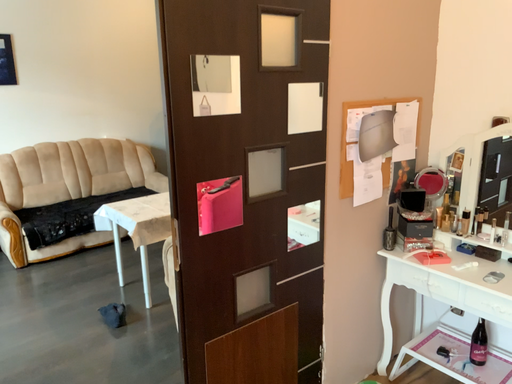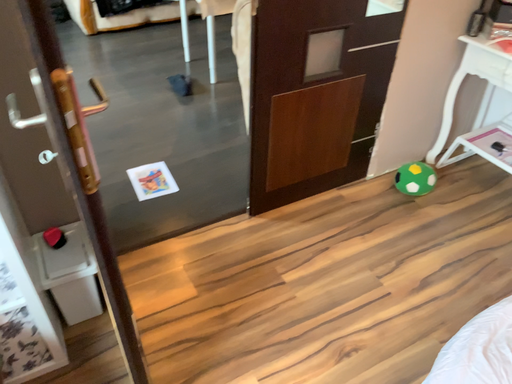
Question: How did the camera likely rotate when shooting the video?

Choices:
 (A) rotated left
 (B) rotated right

Answer: (A)